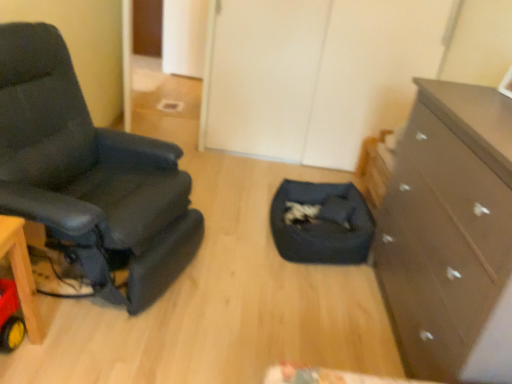
Image resolution: width=512 pixels, height=384 pixels. What are the coordinates of `vacant area that lies to the right of black leather chair at left` in the screenshot? It's located at (249, 288).